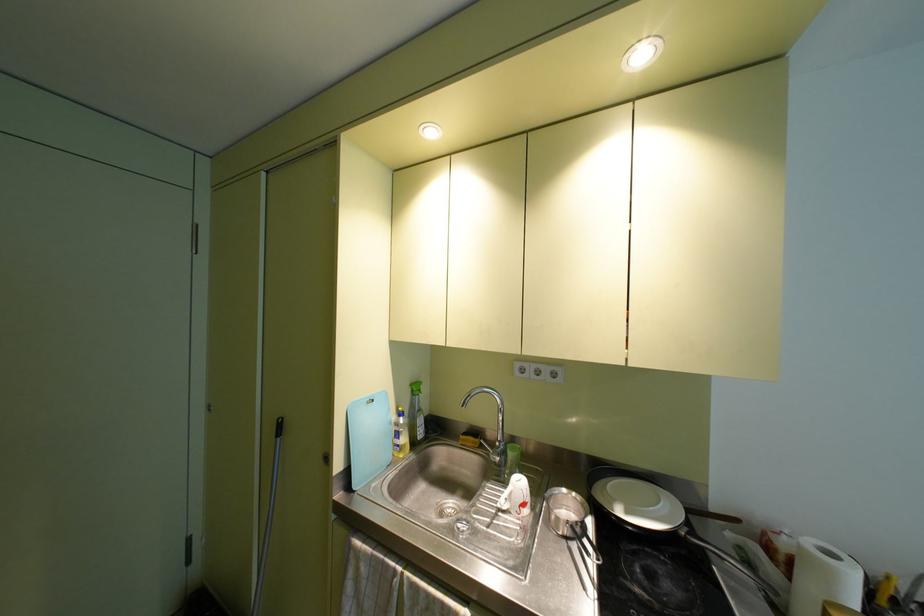
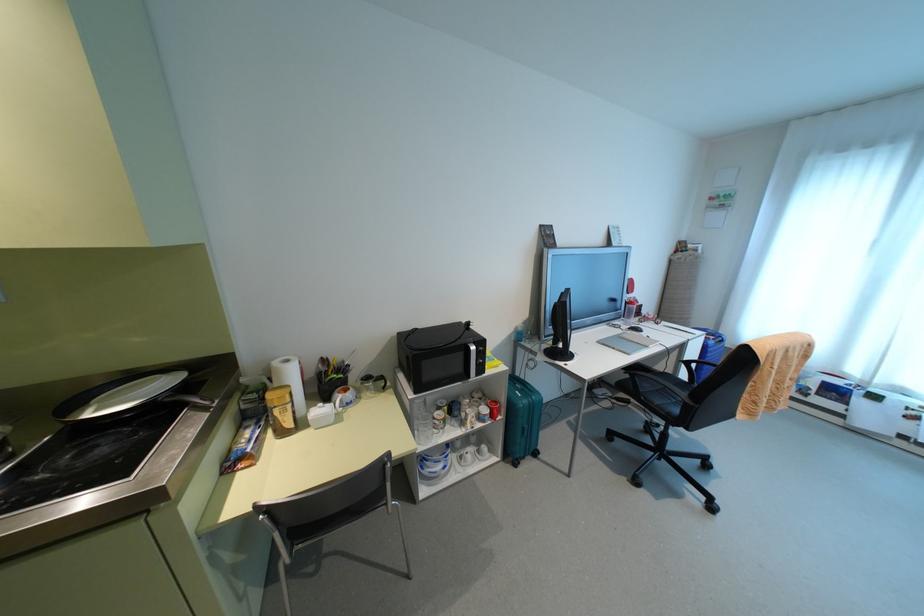
First-person continuous shooting, in which direction is the camera rotating?

The rotation direction of the camera is right-down.